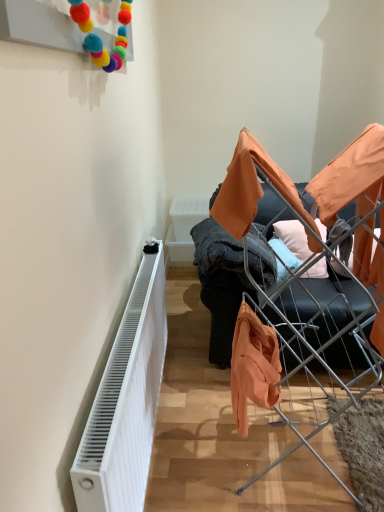
At what (x,y) coordinates should I click in order to perform the action: click on white ribbed radiator at lower left. Please return your answer as a coordinate pair (x, y). The height and width of the screenshot is (512, 384). Looking at the image, I should click on (126, 401).

Measure the distance between point (342, 298) and camera.

They are 6.00 feet apart.

This screenshot has height=512, width=384. Identify the location of white ribbed radiator at lower left. (126, 401).

From the image's perspective, does orange fabric at center appear lower than soft cotton pillow at center?

Yes.

From a real-world perspective, is orange fabric at center below soft cotton pillow at center?

No, from a real-world perspective, orange fabric at center is not below soft cotton pillow at center.

Is orange fabric at center inside the boundaries of soft cotton pillow at center, or outside?

orange fabric at center cannot be found inside soft cotton pillow at center.

Which object is closer to the camera, orange fabric at center or soft cotton pillow at center?

orange fabric at center is more forward.

Find the location of a particular element. radiator in front of the orange fabric at center is located at coordinates (126, 401).

Is orange fabric at center bigger than white ribbed radiator at lower left?

Correct, orange fabric at center is larger in size than white ribbed radiator at lower left.

Is orange fabric at center facing away from white ribbed radiator at lower left?

No, orange fabric at center is not facing away from white ribbed radiator at lower left.

Does soft cotton pillow at center have a lesser height compared to orange fabric at center?

Correct, soft cotton pillow at center is not as tall as orange fabric at center.

From a real-world perspective, who is located lower, soft cotton pillow at center or orange fabric at center?

From a 3D spatial view, soft cotton pillow at center is below.

Between point (301, 260) and point (244, 240), which one is positioned in front?

The point (244, 240) is in front.

Can we say orange fabric couch at center lies outside white ribbed radiator at lower left?

Yes, orange fabric couch at center is located beyond the bounds of white ribbed radiator at lower left.

From a real-world perspective, which is physically below, orange fabric couch at center or white ribbed radiator at lower left?

white ribbed radiator at lower left.

Consider the image. Is orange fabric couch at center wider or thinner than white ribbed radiator at lower left?

Clearly, orange fabric couch at center has more width compared to white ribbed radiator at lower left.

Is orange fabric at center wider than orange fabric couch at center?

In fact, orange fabric at center might be narrower than orange fabric couch at center.

From the image's perspective, would you say orange fabric at center is positioned over orange fabric couch at center?

Incorrect, from the image's perspective, orange fabric at center is lower than orange fabric couch at center.

Based on the photo, how much distance is there between orange fabric at center and orange fabric couch at center?

orange fabric at center is 12.40 inches away from orange fabric couch at center.

Considering the sizes of objects orange fabric at center and orange fabric couch at center in the image provided, who is bigger, orange fabric at center or orange fabric couch at center?

orange fabric couch at center.

Is orange fabric couch at center beside soft cotton pillow at center?

No, orange fabric couch at center is not with soft cotton pillow at center.

Is orange fabric couch at center looking in the opposite direction of soft cotton pillow at center?

Correct, orange fabric couch at center is looking away from soft cotton pillow at center.

Is orange fabric couch at center wider or thinner than soft cotton pillow at center?

Considering their sizes, orange fabric couch at center looks broader than soft cotton pillow at center.

Does point (238, 297) come farther from viewer compared to point (323, 229)?

That is True.

In the scene shown: Is white ribbed radiator at lower left inside soft cotton pillow at center?

That's incorrect, white ribbed radiator at lower left is not inside soft cotton pillow at center.

How much distance is there between soft cotton pillow at center and white ribbed radiator at lower left?

soft cotton pillow at center is 1.06 meters away from white ribbed radiator at lower left.

Is soft cotton pillow at center facing towards white ribbed radiator at lower left?

No, soft cotton pillow at center is not turned towards white ribbed radiator at lower left.

Considering the relative sizes of soft cotton pillow at center and white ribbed radiator at lower left in the image provided, is soft cotton pillow at center wider than white ribbed radiator at lower left?

Yes.

I want to click on bunk bed below the soft cotton pillow at center (from the image's perspective), so [298, 287].

Where is `bunk bed above the white ribbed radiator at lower left (from the image's perspective)`? bunk bed above the white ribbed radiator at lower left (from the image's perspective) is located at coordinates (298, 287).

From the image, which object appears to be nearer to orange fabric at center, soft cotton pillow at center or white ribbed radiator at lower left?

Among the two, soft cotton pillow at center is located nearer to orange fabric at center.

In the scene shown: Estimate the real-world distances between objects in this image. Which object is further from orange fabric at center, soft cotton pillow at center or orange fabric couch at center?

Based on the image, soft cotton pillow at center appears to be further to orange fabric at center.

Based on their spatial positions, is orange fabric couch at center or orange fabric at center closer to white ribbed radiator at lower left?

orange fabric couch at center lies closer to white ribbed radiator at lower left than the other object.

Which object lies nearer to the anchor point white ribbed radiator at lower left, orange fabric couch at center or soft cotton pillow at center?

The object closer to white ribbed radiator at lower left is orange fabric couch at center.

From the image, which object appears to be farther from white ribbed radiator at lower left, orange fabric at center or orange fabric couch at center?

Among the two, orange fabric at center is located further to white ribbed radiator at lower left.

Based on their spatial positions, is white ribbed radiator at lower left or orange fabric at center closer to orange fabric couch at center?

orange fabric at center is closer to orange fabric couch at center.

Estimate the real-world distances between objects in this image. Which object is closer to soft cotton pillow at center, orange fabric at center or white ribbed radiator at lower left?

orange fabric at center lies closer to soft cotton pillow at center than the other object.

Which object lies nearer to the anchor point orange fabric couch at center, soft cotton pillow at center or white ribbed radiator at lower left?

soft cotton pillow at center lies closer to orange fabric couch at center than the other object.

The image size is (384, 512). I want to click on bunk bed positioned between white ribbed radiator at lower left and orange fabric couch at center from near to far, so click(x=298, y=287).

The image size is (384, 512). What are the coordinates of `furniture between orange fabric at center and soft cotton pillow at center along the z-axis` in the screenshot? It's located at (219, 293).

Find the location of a particular element. furniture between white ribbed radiator at lower left and soft cotton pillow at center from front to back is located at coordinates (219, 293).

Where is `bunk bed between white ribbed radiator at lower left and soft cotton pillow at center in the front-back direction`? bunk bed between white ribbed radiator at lower left and soft cotton pillow at center in the front-back direction is located at coordinates (298, 287).